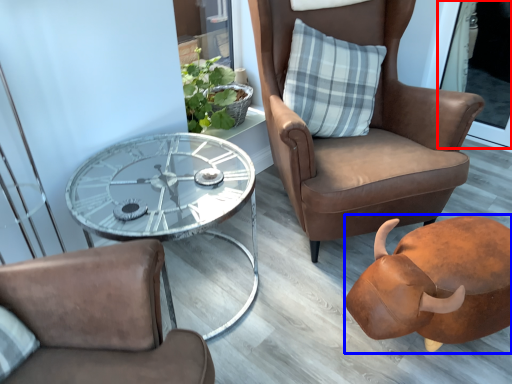
Question: Which point is further to the camera, screen door (highlighted by a red box) or piggy bank (highlighted by a blue box)?

Choices:
 (A) screen door
 (B) piggy bank

Answer: (A)